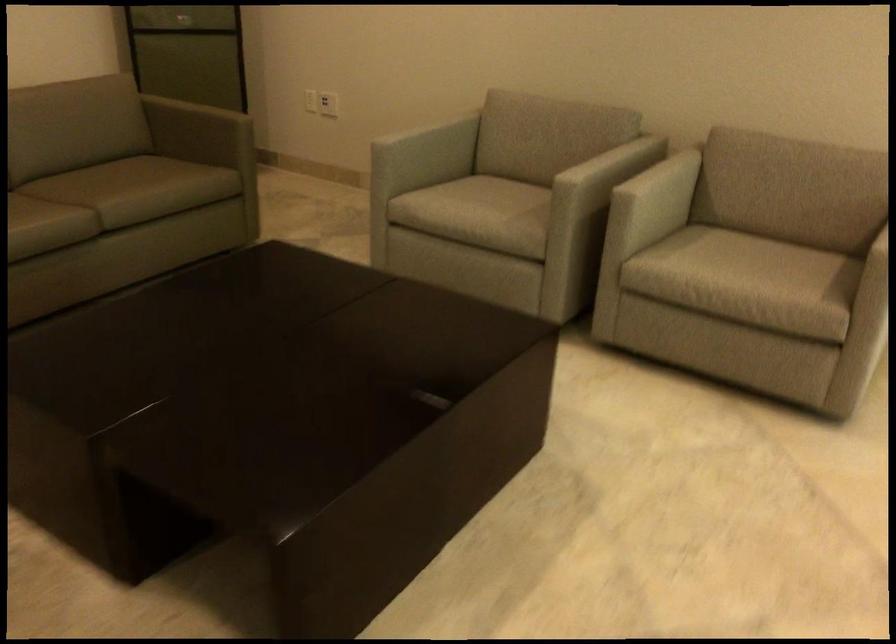
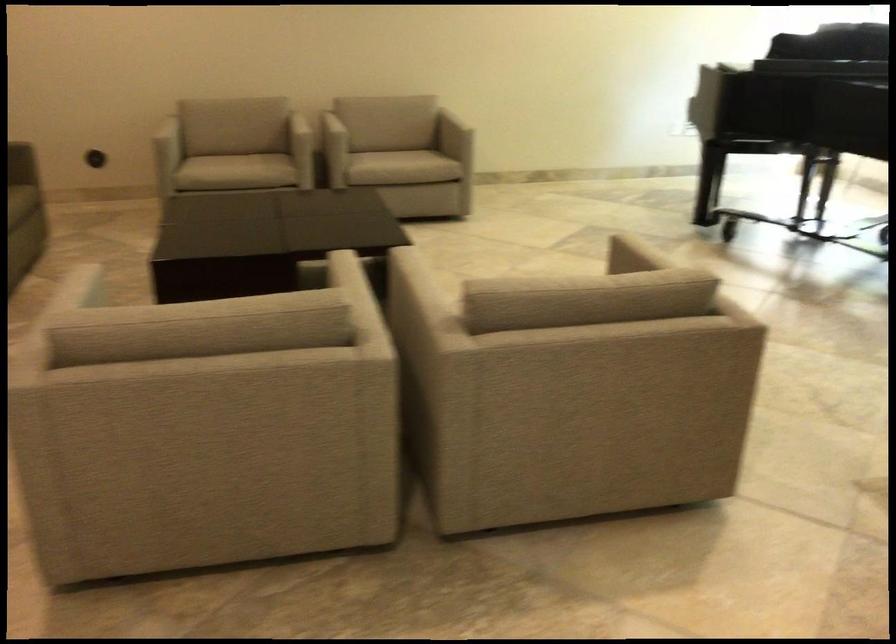
Find the pixel in the second image that matches the point at 588,149 in the first image.

(271, 117)